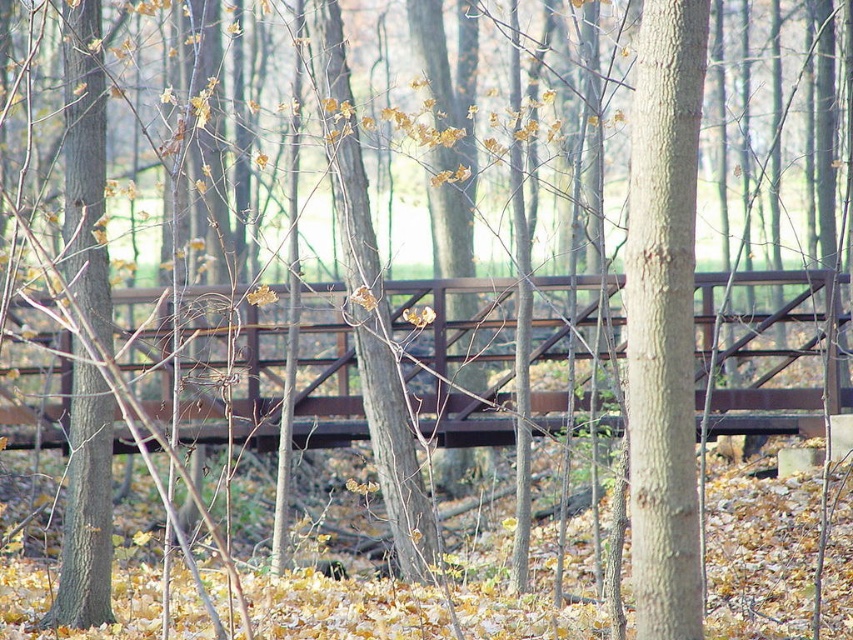
Question: Is brown metal bridge at center smaller than smooth brown tree trunk at left?

Choices:
 (A) no
 (B) yes

Answer: (A)

Question: Which point is farther to the camera?

Choices:
 (A) (109, 529)
 (B) (671, 452)
 (C) (321, 285)

Answer: (C)

Question: Among these objects, which one is farthest from the camera?

Choices:
 (A) smooth brown tree trunk at left
 (B) brown metal bridge at center

Answer: (A)

Question: Which point appears farthest from the camera in this image?

Choices:
 (A) (79, 577)
 (B) (643, 40)
 (C) (828, 300)

Answer: (A)

Question: Does smooth gray bark at center lie behind smooth brown tree trunk at left?

Choices:
 (A) yes
 (B) no

Answer: (B)

Question: Does brown metal bridge at center appear under smooth brown tree trunk at left?

Choices:
 (A) no
 (B) yes

Answer: (B)